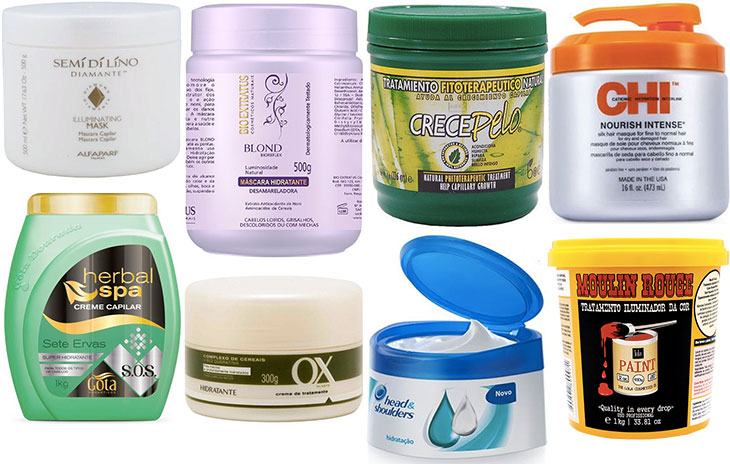
I want to click on jars, so click(58, 354), click(296, 348), click(523, 452), click(622, 371), click(610, 181), click(511, 151), click(274, 144), click(104, 85).